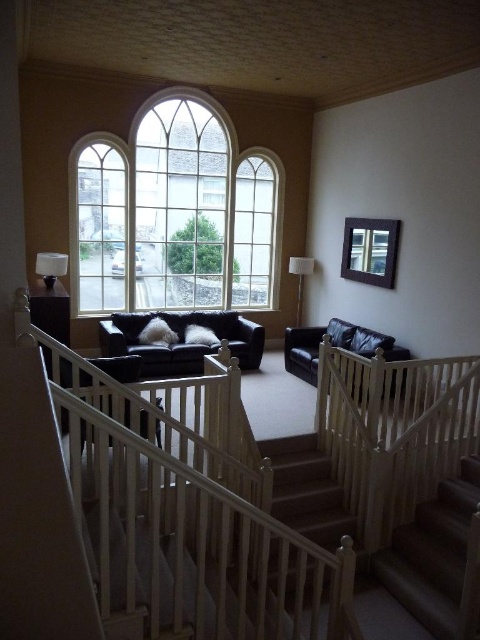
Can you confirm if matte black lamp at left is smaller than matte white lamp at center?

Actually, matte black lamp at left might be larger than matte white lamp at center.

Is matte black lamp at left above matte white lamp at center?

Actually, matte black lamp at left is below matte white lamp at center.

Identify the location of matte black lamp at left. The height and width of the screenshot is (640, 480). (50, 266).

I want to click on matte black lamp at left, so click(50, 266).

Which is behind, point (405, 596) or point (309, 268)?

The point (309, 268) is more distant.

Who is taller, dark brown carpeted stairs at center or matte white lamp at center?

With more height is dark brown carpeted stairs at center.

Is point (399, 595) closer to camera compared to point (300, 317)?

Yes, it is.

The height and width of the screenshot is (640, 480). What are the coordinates of `dark brown carpeted stairs at center` in the screenshot? It's located at (432, 554).

Is point (457, 529) behind point (93, 221)?

No.

Is dark brown carpeted stairs at center smaller than clear glass window at upper left?

Indeed, dark brown carpeted stairs at center has a smaller size compared to clear glass window at upper left.

Between point (463, 481) and point (90, 170), which one is positioned behind?

Positioned behind is point (90, 170).

Where is `dark brown carpeted stairs at center`? This screenshot has width=480, height=640. dark brown carpeted stairs at center is located at coordinates (432, 554).